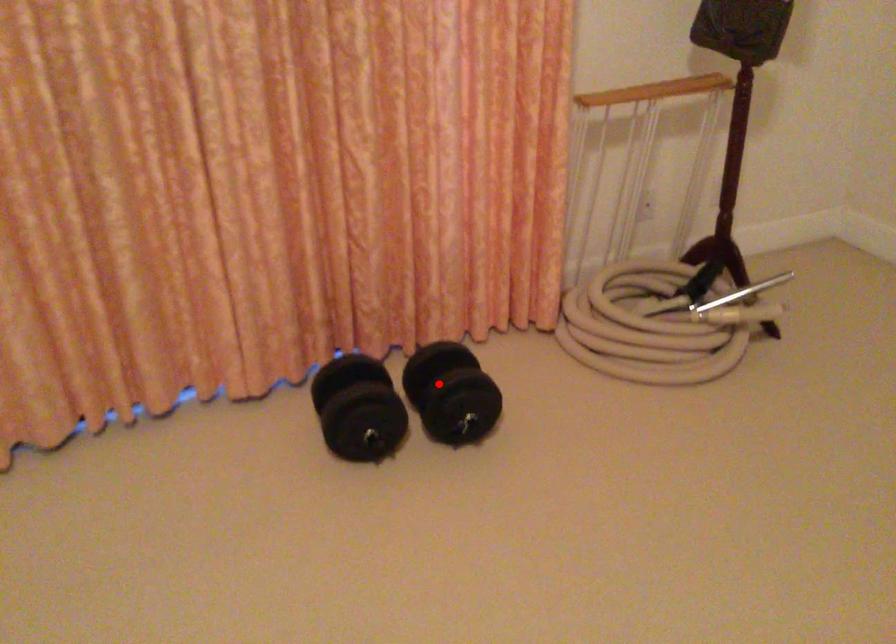
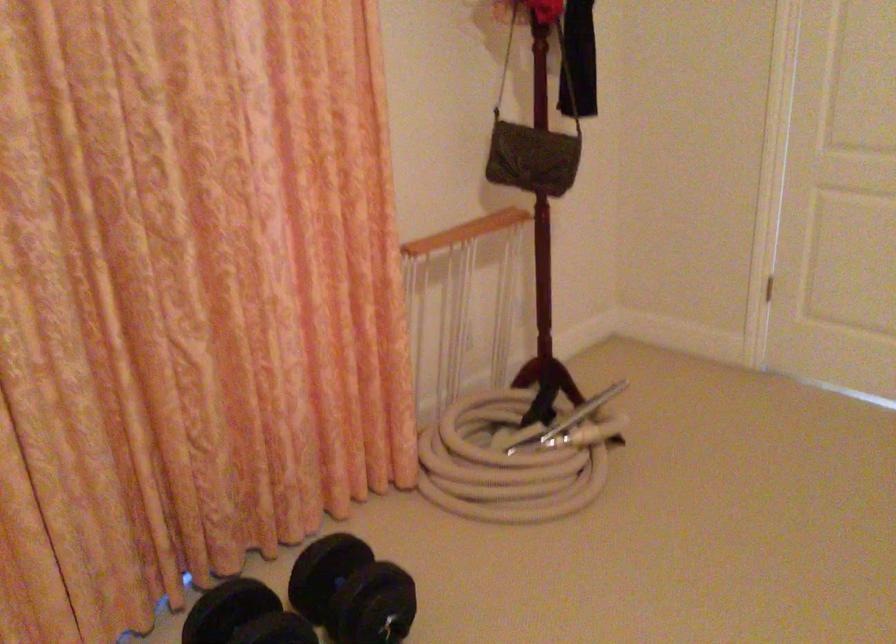
Question: A red point is marked in image1. In image2, is the corresponding 3D point closer to the camera or farther? Reply with the corresponding letter.

Choices:
 (A) The corresponding 3D point is closer.
 (B) The corresponding 3D point is farther.

Answer: (A)